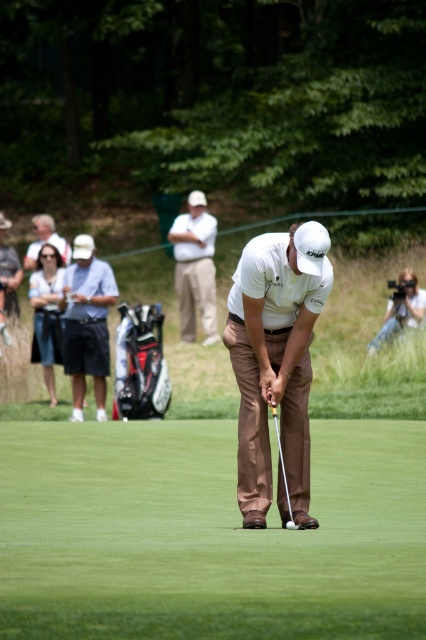
Between matte white camera at right and white matte golf ball at center, which one is positioned higher?

Positioned higher is matte white camera at right.

Does matte white camera at right have a greater width compared to white matte golf ball at center?

Correct, the width of matte white camera at right exceeds that of white matte golf ball at center.

Find the location of a particular element. The height and width of the screenshot is (640, 426). matte white camera at right is located at coordinates (400, 308).

Who is positioned more to the left, dark blue cotton shorts at left or matte white cap at upper center?

matte white cap at upper center

Is point (69, 304) positioned in front of point (63, 237)?

Yes, it is in front of point (63, 237).

Where is `dark blue cotton shorts at left`? dark blue cotton shorts at left is located at coordinates (86, 323).

Does white cotton shirt at upper center lie behind matte white camera at right?

Yes, it is.

Can you confirm if white cotton shirt at upper center is bigger than matte white camera at right?

Indeed, white cotton shirt at upper center has a larger size compared to matte white camera at right.

Locate an element on the screen. The height and width of the screenshot is (640, 426). white cotton shirt at upper center is located at coordinates (195, 268).